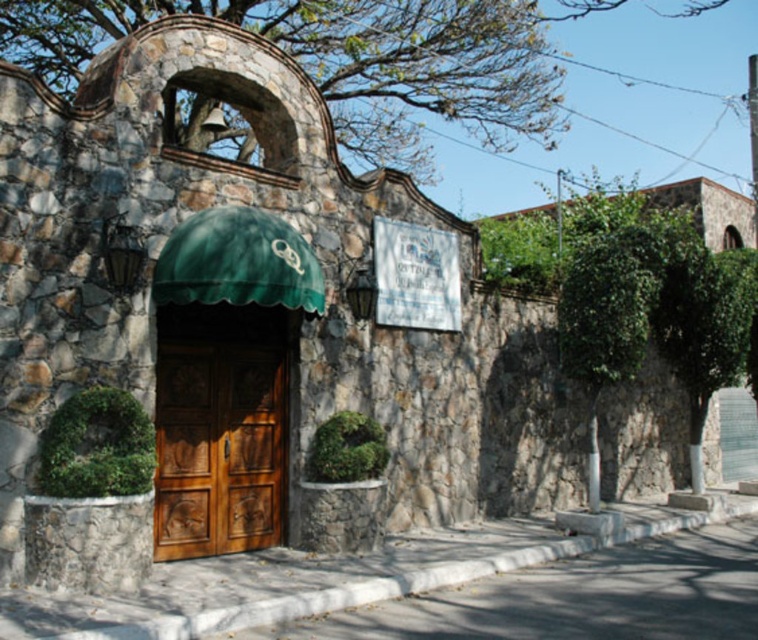
Question: Considering the relative positions of green leafy tree at upper center and wooden door at center in the image provided, where is green leafy tree at upper center located with respect to wooden door at center?

Choices:
 (A) left
 (B) right

Answer: (B)

Question: Which point is farther to the camera?

Choices:
 (A) wooden door at center
 (B) green leafy tree at upper center

Answer: (B)

Question: Is green leafy tree at upper center above wooden door at center?

Choices:
 (A) no
 (B) yes

Answer: (B)

Question: Which point is farther from the camera taking this photo?

Choices:
 (A) (199, 442)
 (B) (371, 77)

Answer: (B)

Question: In this image, where is green leafy tree at upper center located relative to wooden door at center?

Choices:
 (A) below
 (B) above

Answer: (B)